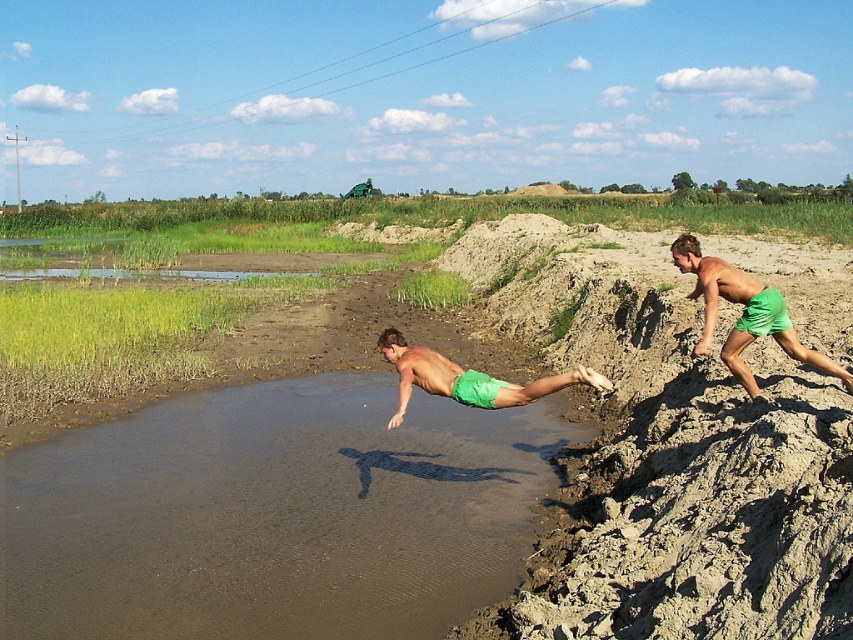
Question: Is green fabric shorts at right smaller than green matte shorts at center?

Choices:
 (A) yes
 (B) no

Answer: (A)

Question: Can you confirm if green fabric shorts at right is thinner than green matte shorts at center?

Choices:
 (A) no
 (B) yes

Answer: (B)

Question: Among these points, which one is farthest from the camera?

Choices:
 (A) pos(740,288)
 (B) pos(399,356)

Answer: (B)

Question: Which point is closer to the camera?

Choices:
 (A) green matte shorts at center
 (B) green fabric shorts at right

Answer: (A)

Question: Observing the image, what is the correct spatial positioning of green fabric shorts at right in reference to green matte shorts at center?

Choices:
 (A) below
 (B) above

Answer: (B)